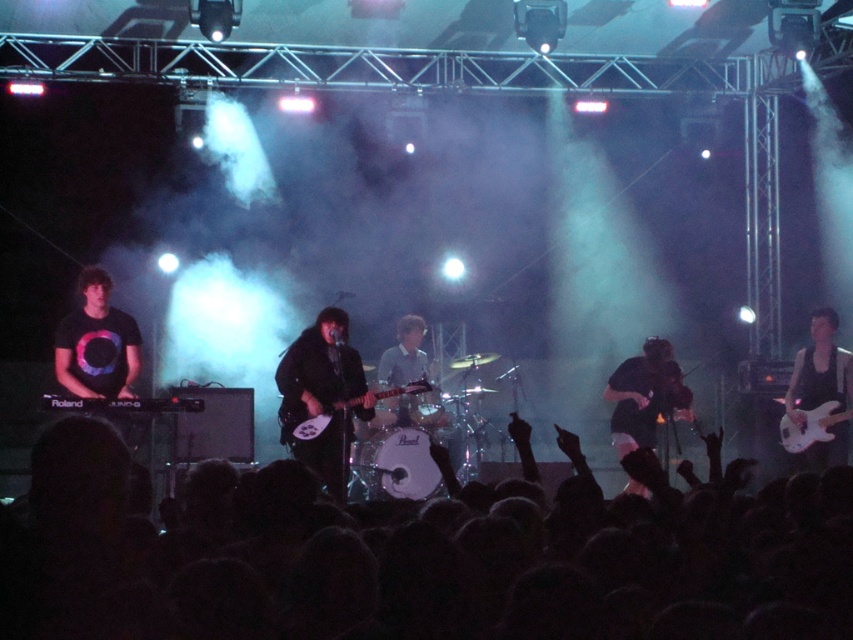
Question: Which point is closer to the camera taking this photo?

Choices:
 (A) (282, 406)
 (B) (344, 403)

Answer: (A)

Question: Is black matte guitar at lower right bigger than glossy white guitar at center?

Choices:
 (A) yes
 (B) no

Answer: (A)

Question: Can you confirm if matte black t-shirt at left is bigger than gray matte shirt at center?

Choices:
 (A) yes
 (B) no

Answer: (B)

Question: Which object is the farthest from the black matte guitar at center?

Choices:
 (A) gray matte shirt at center
 (B) glossy white guitar at center
 (C) matte black t-shirt at left

Answer: (A)

Question: Which point appears closest to the camera in this image?

Choices:
 (A) (421, 332)
 (B) (305, 464)
 (C) (372, 548)
 (D) (112, 388)

Answer: (C)

Question: Does black glossy guitar at right appear under gray matte shirt at center?

Choices:
 (A) yes
 (B) no

Answer: (B)